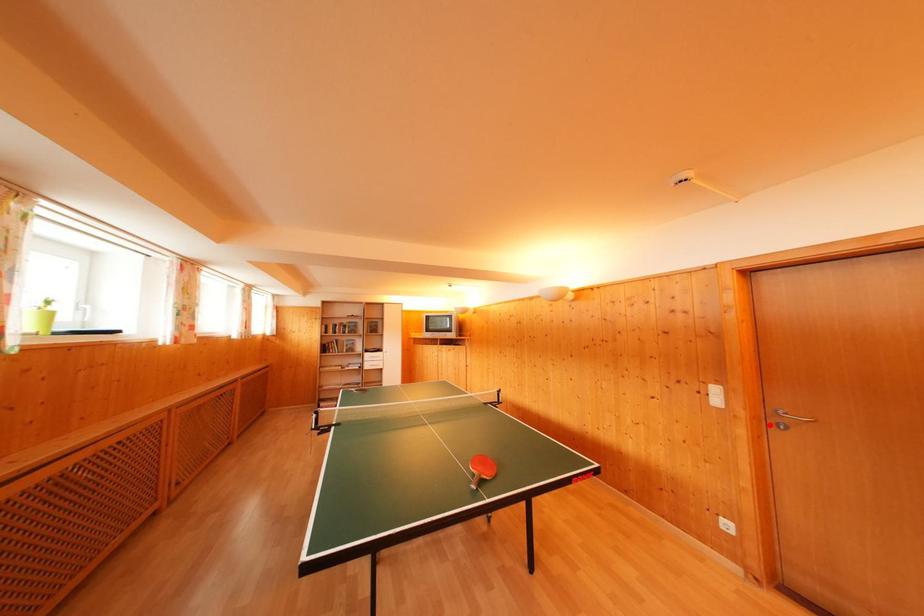
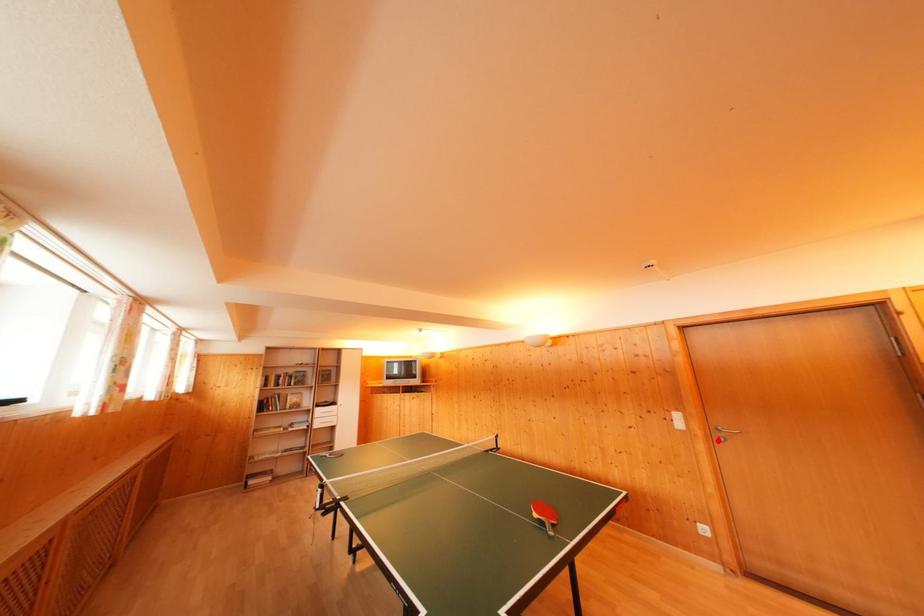
Consider the image. I am providing you with two images of the same scene from different viewpoints. A red point is marked on the first image and another point is marked on the second image. Is the red point in image1 aligned with the point shown in image2?

Yes